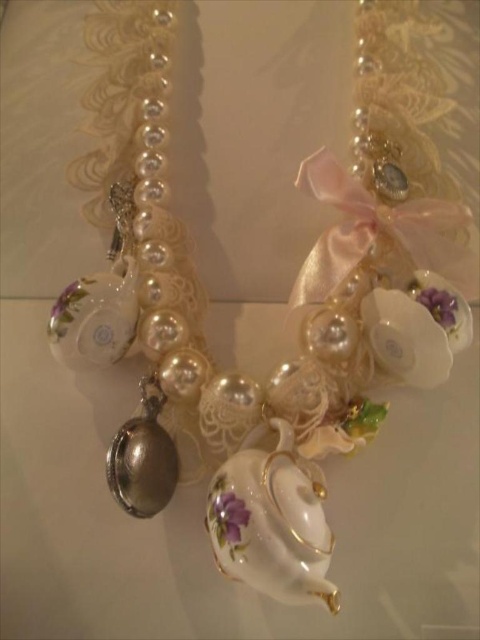
Question: Which object is the farthest from the purple porcelain flower at center?

Choices:
 (A) porcelain teapot at center
 (B) purple glossy flower at center

Answer: (B)

Question: Does purple glossy flower at center come behind purple porcelain flower at center?

Choices:
 (A) no
 (B) yes

Answer: (A)

Question: Among these objects, which one is nearest to the camera?

Choices:
 (A) porcelain teapot at center
 (B) purple porcelain flower at center
 (C) purple glossy flower at center

Answer: (A)

Question: Does porcelain teapot at center have a greater width compared to purple porcelain flower at center?

Choices:
 (A) yes
 (B) no

Answer: (A)

Question: Does porcelain teapot at center appear under purple glossy flower at center?

Choices:
 (A) yes
 (B) no

Answer: (B)

Question: Which point is farther to the camera?

Choices:
 (A) (428, 307)
 (B) (219, 529)
 (C) (223, 516)

Answer: (A)